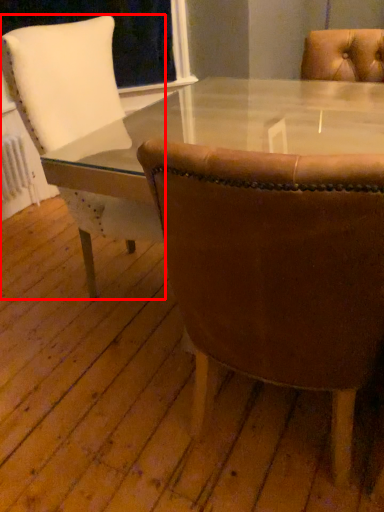
Question: From the image's perspective, considering the relative positions of chair (annotated by the red box) and chair in the image provided, where is chair (annotated by the red box) located with respect to the staircase?

Choices:
 (A) above
 (B) below

Answer: (A)